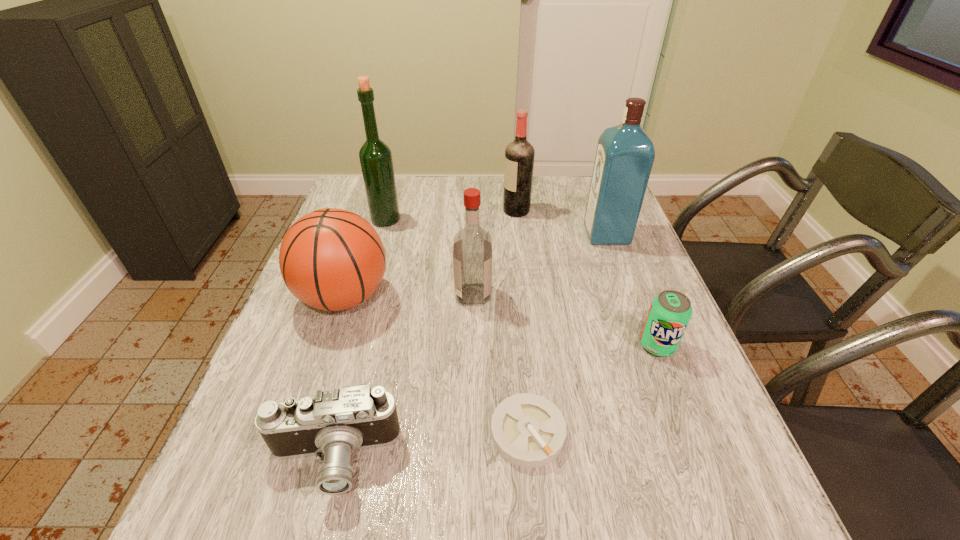
This screenshot has width=960, height=540. What are the coordinates of `free region located on the flat label side of the rightmost liquor` in the screenshot? It's located at (466, 235).

Find the location of `vacant space located 0.100m on the flat label side of the rightmost liquor`. vacant space located 0.100m on the flat label side of the rightmost liquor is located at coordinates (552, 235).

This screenshot has width=960, height=540. I want to click on blank area located on the front-facing side of the second liquor from right to left, so click(487, 211).

The height and width of the screenshot is (540, 960). Find the location of `free space located on the front-facing side of the second liquor from right to left`. free space located on the front-facing side of the second liquor from right to left is located at coordinates (477, 211).

Where is `free space located 0.300m on the front-facing side of the second liquor from right to left`? free space located 0.300m on the front-facing side of the second liquor from right to left is located at coordinates (407, 211).

The width and height of the screenshot is (960, 540). What are the coordinates of `vacant point located 0.310m on the front-facing side of the second liquor from left to right` in the screenshot? It's located at (616, 294).

Where is `free point located on the front of the basketball`? This screenshot has width=960, height=540. free point located on the front of the basketball is located at coordinates (273, 510).

Find the location of a particular element. vacant region located 0.310m on the front-facing side of the pop soda is located at coordinates (723, 514).

This screenshot has width=960, height=540. I want to click on vacant space located on the left of the shortest object, so click(377, 433).

I want to click on object that is at the near edge, so tap(334, 423).